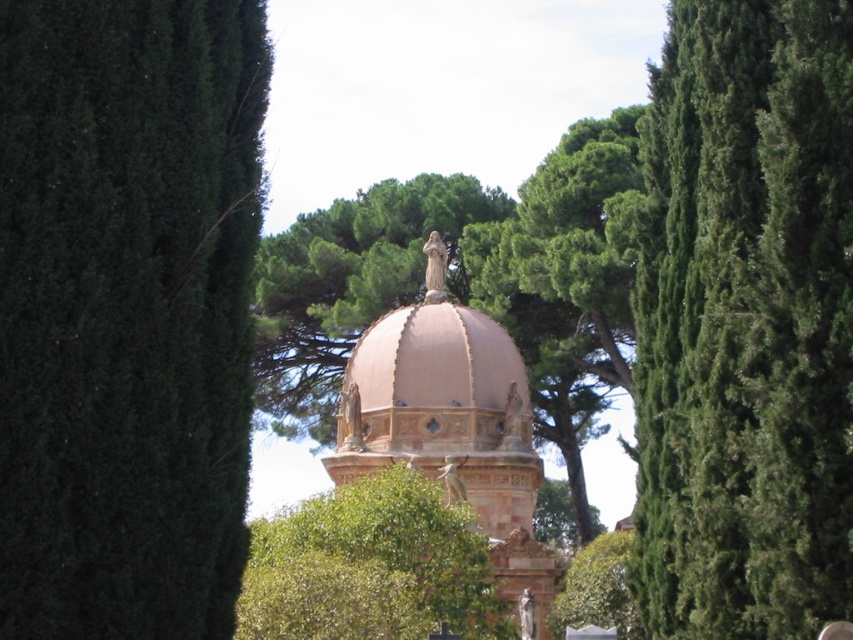
Does green textured tree at left appear over pink stone dome at center?

Yes.

Is green textured tree at left positioned before pink stone dome at center?

Yes, green textured tree at left is in front of pink stone dome at center.

Find the location of a particular element. This screenshot has height=640, width=853. green textured tree at left is located at coordinates (126, 310).

Can you confirm if green textured tree at right is wider than green leafy tree at center?

In fact, green textured tree at right might be narrower than green leafy tree at center.

Does green textured tree at right have a greater height compared to green leafy tree at center?

Indeed, green textured tree at right has a greater height compared to green leafy tree at center.

Is point (712, 307) behind point (383, 616)?

That is False.

Locate an element on the screen. green textured tree at right is located at coordinates (746, 323).

Which of these two, green textured tree at left or green leafy tree at center, stands shorter?

green leafy tree at center is shorter.

Does green textured tree at left come behind green leafy tree at center?

No, it is in front of green leafy tree at center.

The width and height of the screenshot is (853, 640). What are the coordinates of `green textured tree at left` in the screenshot? It's located at (126, 310).